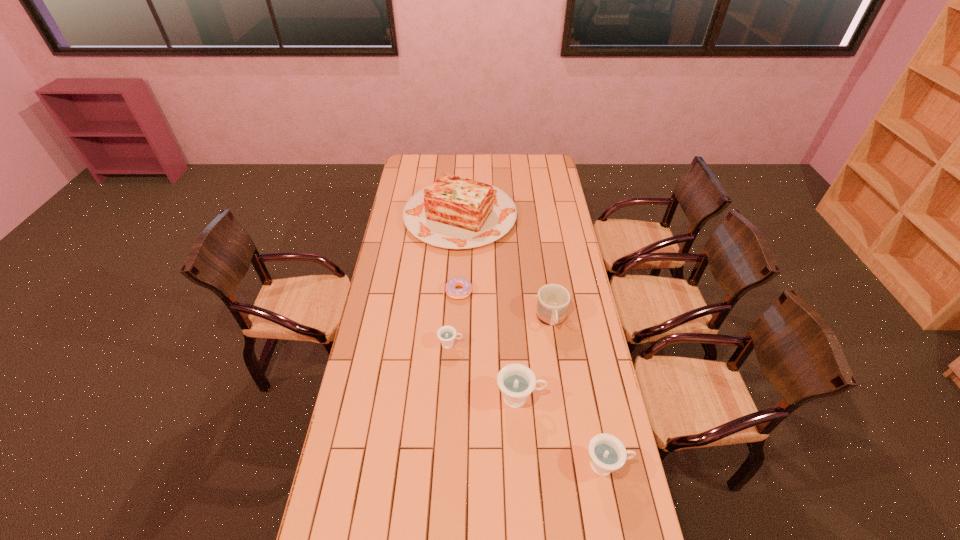
The image size is (960, 540). Identify the location of unoccupied area between the second tallest teacup and the shortest teacup. (529, 404).

The height and width of the screenshot is (540, 960). I want to click on empty location between the leftmost teacup and the second shortest teacup, so click(529, 404).

Where is `unoccupied area between the tallest object and the mug`? Image resolution: width=960 pixels, height=540 pixels. unoccupied area between the tallest object and the mug is located at coordinates (506, 268).

The height and width of the screenshot is (540, 960). Identify the location of object that is the fourth closest one to the rightmost teacup. (451, 291).

Find the location of a particular element. The width and height of the screenshot is (960, 540). object that can be found as the second closest to the farthest teacup is located at coordinates (451, 291).

Locate which teacup ranks in proximity to the doughnut. Please provide its 2D coordinates. Your answer should be formatted as a tuple, i.e. [(x, y)], where the tuple contains the x and y coordinates of a point satisfying the conditions above.

[(447, 334)]

Where is `teacup that is the second closest to the second nearest teacup`? teacup that is the second closest to the second nearest teacup is located at coordinates (447, 334).

This screenshot has height=540, width=960. I want to click on vacant space that satisfies the following two spatial constraints: 1. on the side with the handle of the mug; 2. on the side of the farthest teacup with the handle, so click(x=555, y=344).

I want to click on free space that satisfies the following two spatial constraints: 1. on the side with the handle of the mug; 2. on the side of the farthest teacup with the handle, so click(555, 344).

Where is `free space that satisfies the following two spatial constraints: 1. on the side with the handle of the mug; 2. on the side of the fifth tallest object with the handle`? The width and height of the screenshot is (960, 540). free space that satisfies the following two spatial constraints: 1. on the side with the handle of the mug; 2. on the side of the fifth tallest object with the handle is located at coordinates (555, 344).